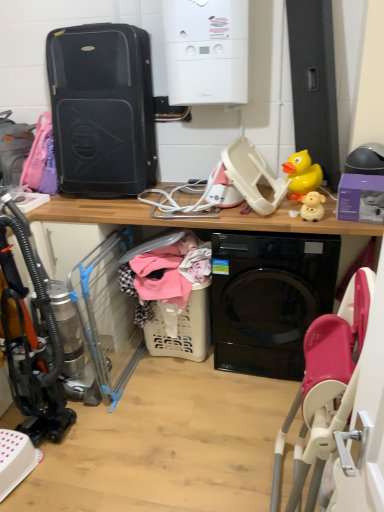
Question: Should I look upward or downward to see white matte sheep at upper right, the second toy in the back-to-front sequence?

Choices:
 (A) up
 (B) down

Answer: (A)

Question: Is white matte boiler at upper center shorter than yellow rubber duck at upper right, the first toy viewed from the top?

Choices:
 (A) no
 (B) yes

Answer: (A)

Question: From a real-world perspective, is white matte boiler at upper center beneath yellow rubber duck at upper right, acting as the first toy starting from the back?

Choices:
 (A) yes
 (B) no

Answer: (B)

Question: Could you tell me if white matte boiler at upper center is facing yellow rubber duck at upper right, the first toy viewed from the top?

Choices:
 (A) no
 (B) yes

Answer: (A)

Question: Is white matte boiler at upper center positioned far away from yellow rubber duck at upper right, the first toy viewed from the top?

Choices:
 (A) no
 (B) yes

Answer: (A)

Question: Is the position of white matte boiler at upper center less distant than that of yellow rubber duck at upper right, the first toy viewed from the top?

Choices:
 (A) yes
 (B) no

Answer: (A)

Question: Can you confirm if white matte boiler at upper center is smaller than yellow rubber duck at upper right, the second toy positioned from the front?

Choices:
 (A) no
 (B) yes

Answer: (A)

Question: Does black hard shell suitcase at upper left appear on the right side of white matte sheep at upper right, the 1th toy in the bottom-to-top sequence?

Choices:
 (A) no
 (B) yes

Answer: (A)

Question: From the image's perspective, is black hard shell suitcase at upper left under white matte sheep at upper right, the second toy in the back-to-front sequence?

Choices:
 (A) no
 (B) yes

Answer: (A)

Question: From a real-world perspective, is black hard shell suitcase at upper left positioned under white matte sheep at upper right, placed as the second toy when sorted from top to bottom, based on gravity?

Choices:
 (A) no
 (B) yes

Answer: (A)

Question: Would you say black hard shell suitcase at upper left is outside white matte sheep at upper right, placed as the second toy when sorted from top to bottom?

Choices:
 (A) no
 (B) yes

Answer: (B)

Question: Is white matte sheep at upper right, the 1th toy in the bottom-to-top sequence, completely or partially inside black hard shell suitcase at upper left?

Choices:
 (A) no
 (B) yes

Answer: (A)

Question: Would you consider black hard shell suitcase at upper left to be distant from white matte sheep at upper right, the 1th toy in the bottom-to-top sequence?

Choices:
 (A) yes
 (B) no

Answer: (A)

Question: Can you confirm if black hard shell suitcase at upper left is wider than yellow rubber duck at upper right, the second toy positioned from the front?

Choices:
 (A) no
 (B) yes

Answer: (B)